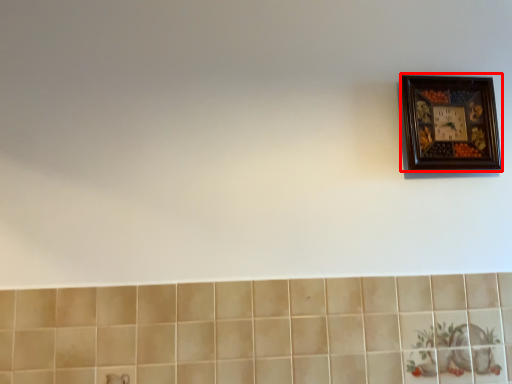
Question: From the image's perspective, where is picture frame (annotated by the red box) located relative to ceramic tile?

Choices:
 (A) below
 (B) above

Answer: (B)